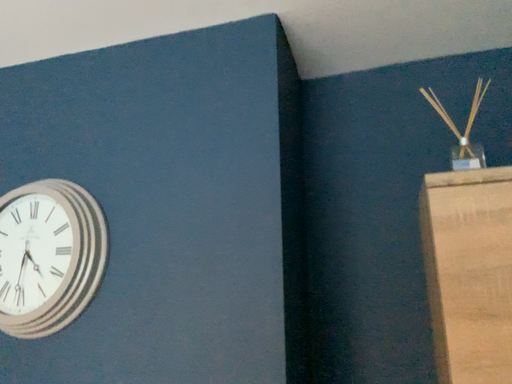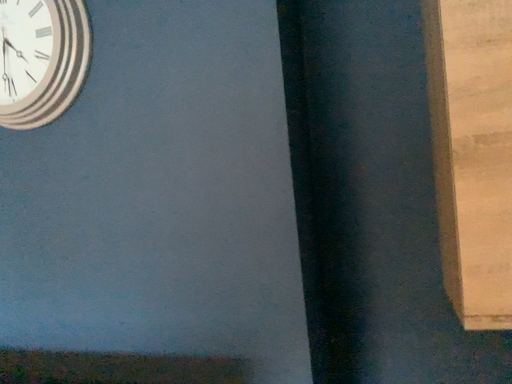
Question: Which way did the camera rotate in the video?

Choices:
 (A) rotated upward
 (B) rotated downward

Answer: (B)